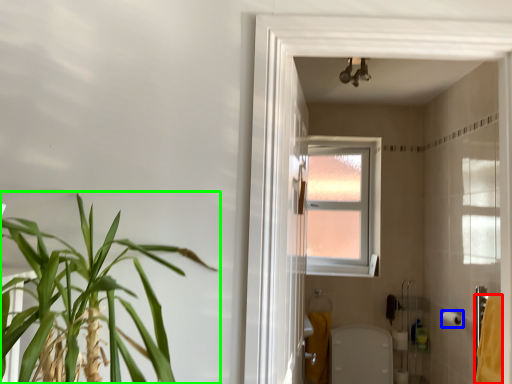
Question: Which object is the farthest from bath towel (highlighted by a red box)? Choose among these: toilet paper (highlighted by a blue box) or houseplant (highlighted by a green box).

Choices:
 (A) toilet paper
 (B) houseplant

Answer: (B)